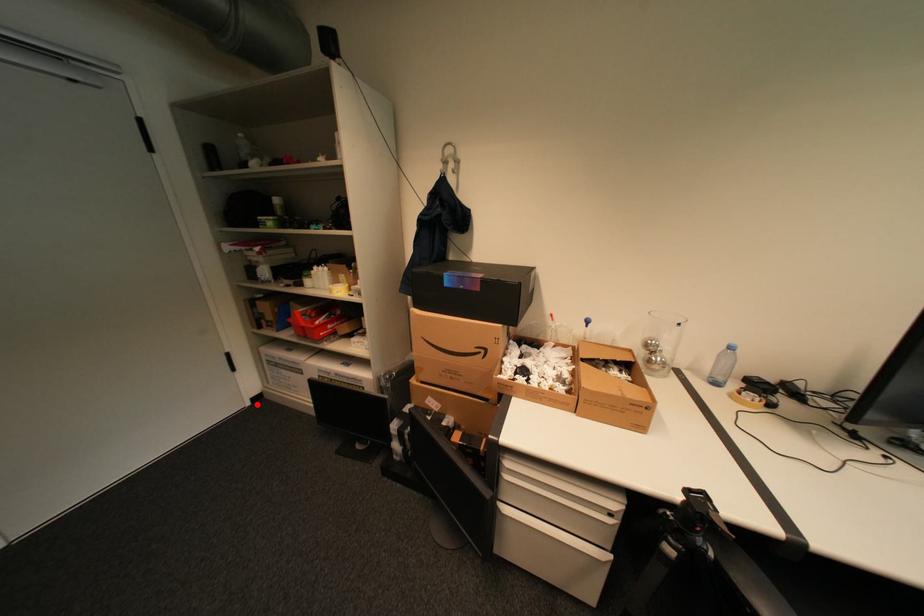
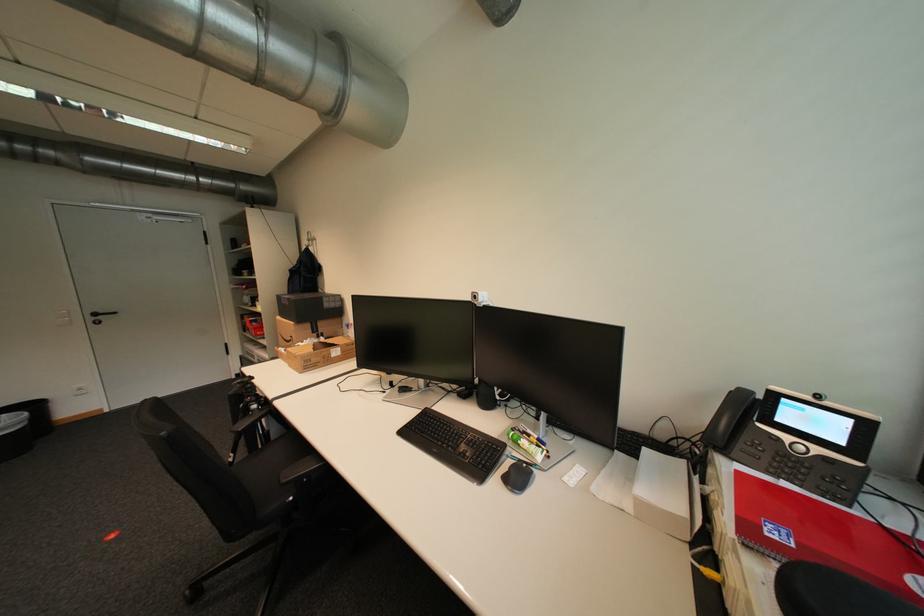
In the second image, find the point that corresponds to the highlighted location in the first image.

(242, 378)